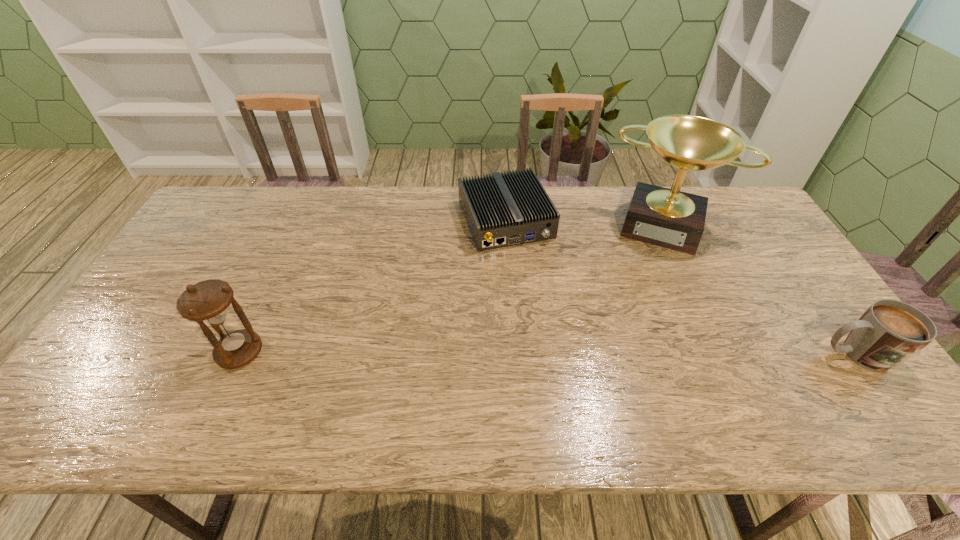
Locate an element on the screen. the leftmost object is located at coordinates (208, 301).

Identify the location of the third shortest object. Image resolution: width=960 pixels, height=540 pixels. 208,301.

Find the location of a particular element. the rightmost object is located at coordinates pos(889,332).

What are the coordinates of `mug` in the screenshot? It's located at (889, 332).

Image resolution: width=960 pixels, height=540 pixels. Identify the location of the shortest object. (501, 210).

Find the location of `the third object from right to left`. the third object from right to left is located at coordinates (501, 210).

Where is `award`? award is located at coordinates (669, 218).

The image size is (960, 540). I want to click on the second object from right to left, so click(669, 218).

Locate an element on the screen. blank space located on the right of the hourglass is located at coordinates tap(323, 352).

Where is `vacant space located on the side of the mug with the handle`? vacant space located on the side of the mug with the handle is located at coordinates (758, 354).